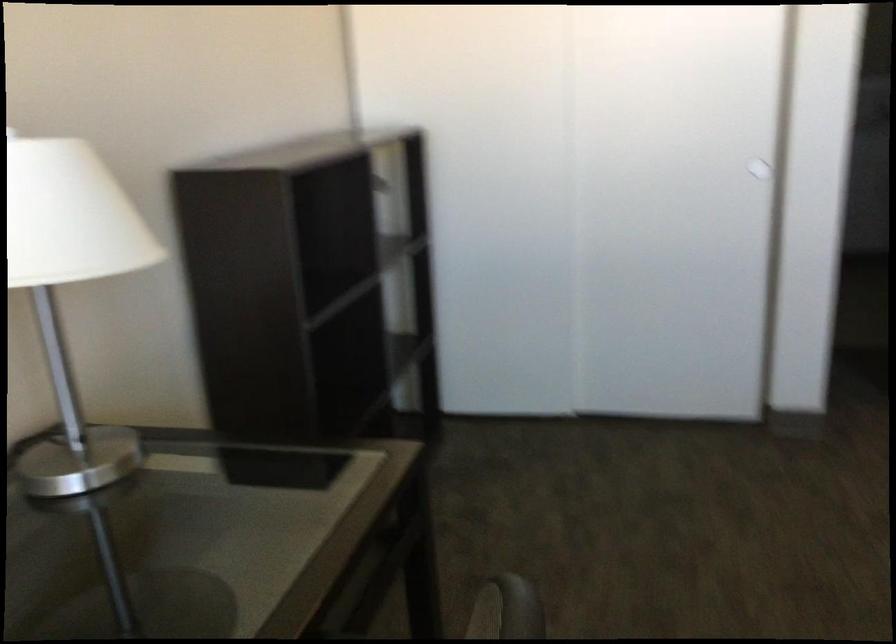
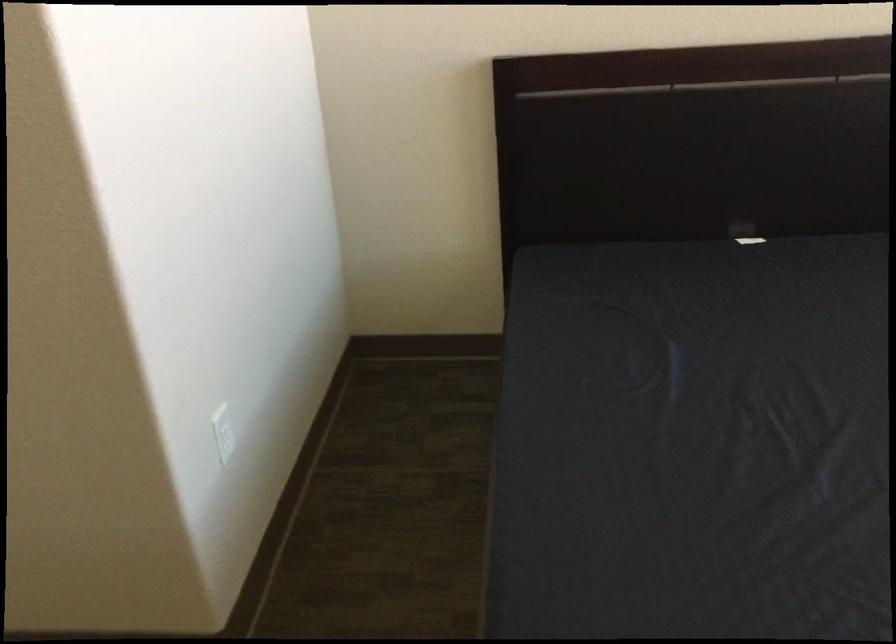
The first image is from the beginning of the video and the second image is from the end. How did the camera likely rotate when shooting the video?

The camera rotated toward right-down.